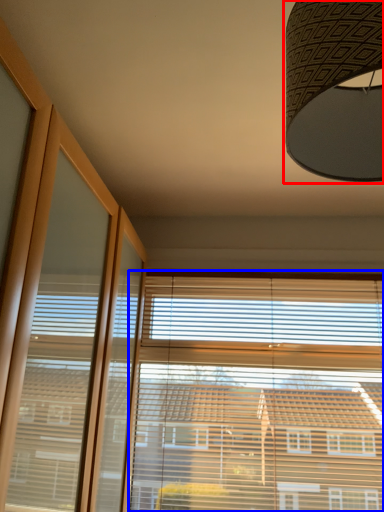
Question: Which object is closer to the camera taking this photo, lamp (highlighted by a red box) or bay window (highlighted by a blue box)?

Choices:
 (A) lamp
 (B) bay window

Answer: (A)